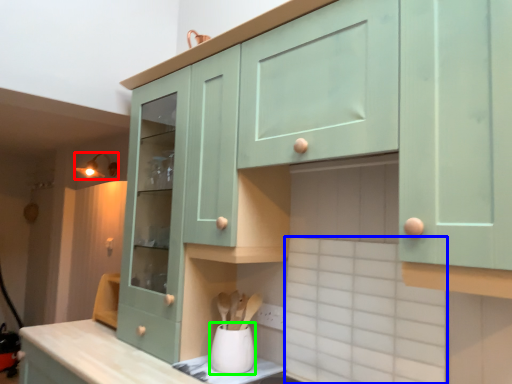
Question: Which is nearer to the light fixture (highlighted by a red box)? ceramic tile (highlighted by a blue box) or appliance (highlighted by a green box).

Choices:
 (A) ceramic tile
 (B) appliance

Answer: (B)